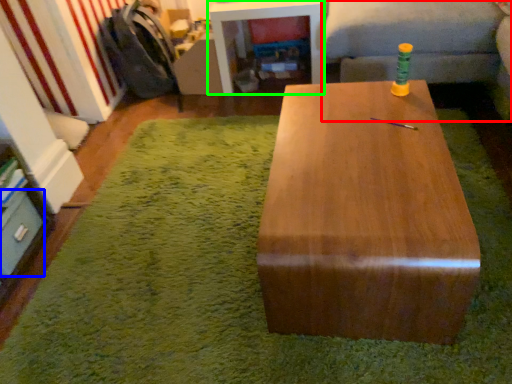
Question: Which object is positioned farthest from couch (highlighted by a red box)? Select from drawer (highlighted by a blue box) and table (highlighted by a green box).

Choices:
 (A) drawer
 (B) table

Answer: (A)